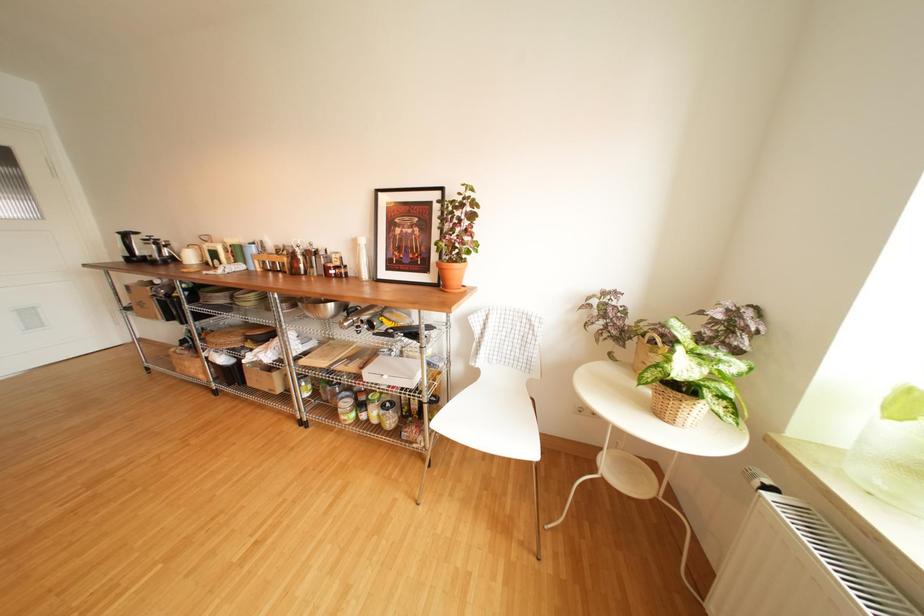
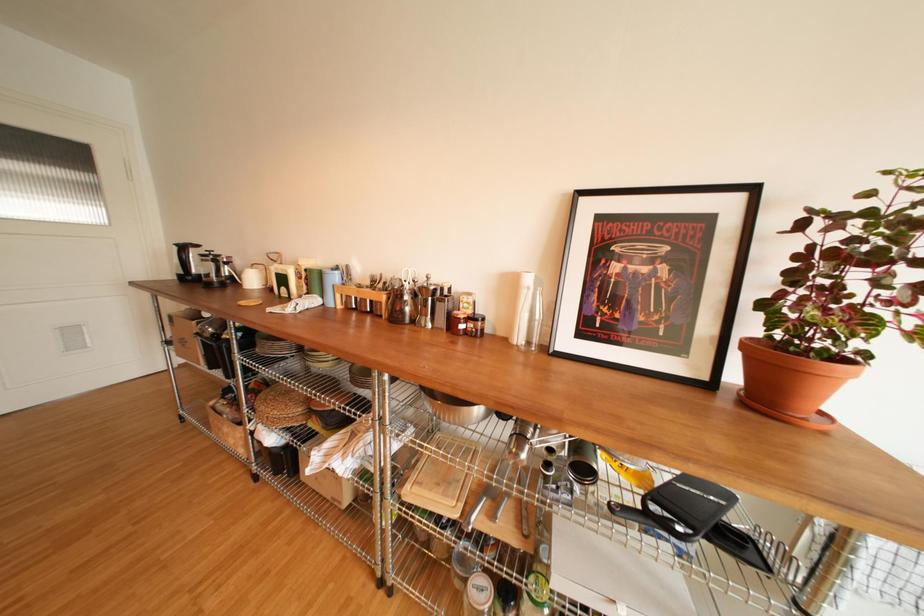
Question: The first image is from the beginning of the video and the second image is from the end. How did the camera likely rotate when shooting the video?

Choices:
 (A) Left
 (B) Right
 (C) Up
 (D) Down

Answer: (A)